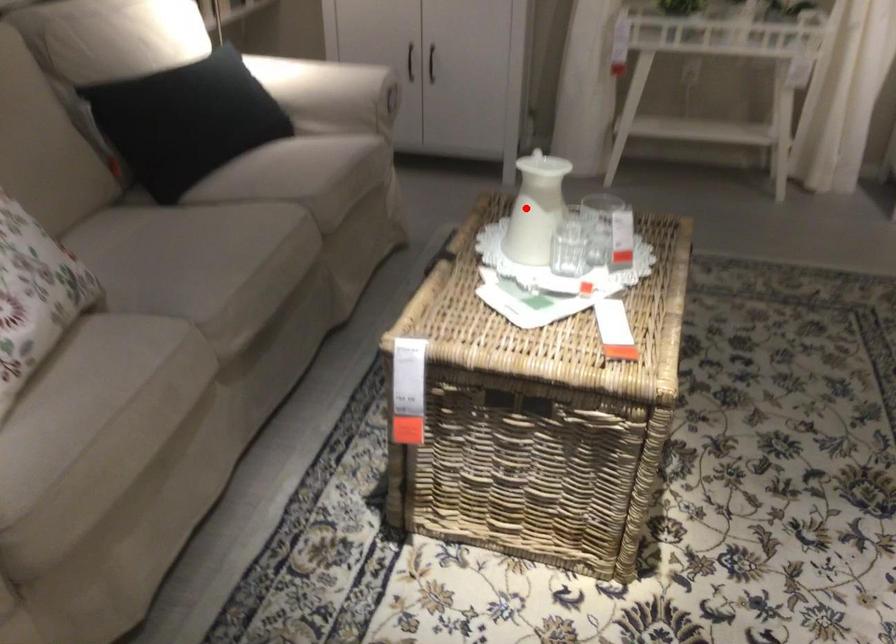
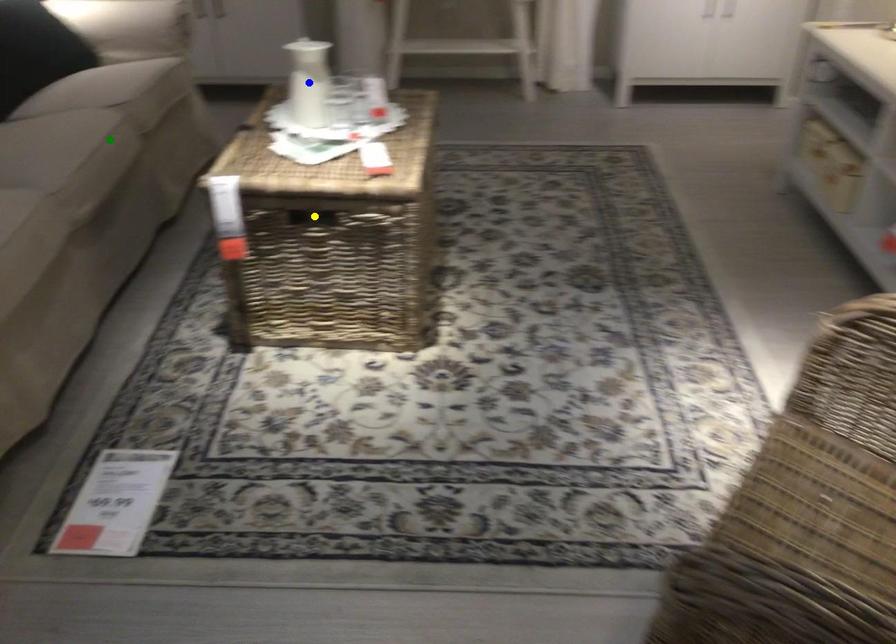
Question: I am providing you with two images of the same scene from different viewpoints. A red point is marked on the first image. You are given multiple points on the second image. Can you choose the point in image 2 that corresponds to the point in image 1?

Choices:
 (A) yellow point
 (B) blue point
 (C) green point

Answer: (B)